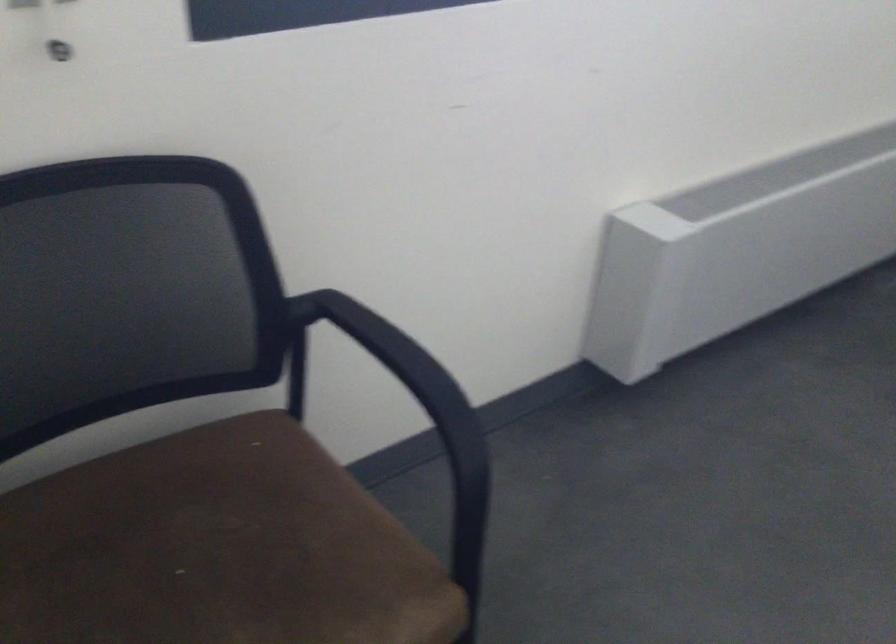
You are a GUI agent. You are given a task and a screenshot of the screen. Output one action in this format:
    pyautogui.click(x=<x>, y=<y>)
    Task: Click on the brown chair sitting surface
    
    Given the screenshot: What is the action you would take?
    pyautogui.click(x=216, y=549)